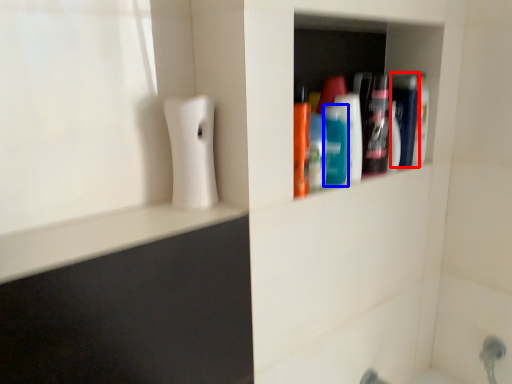
Question: Which point is closer to the camera, mouthwash (highlighted by a red box) or mouthwash (highlighted by a blue box)?

Choices:
 (A) mouthwash
 (B) mouthwash

Answer: (B)